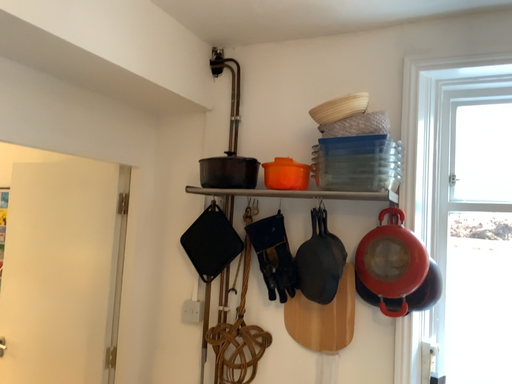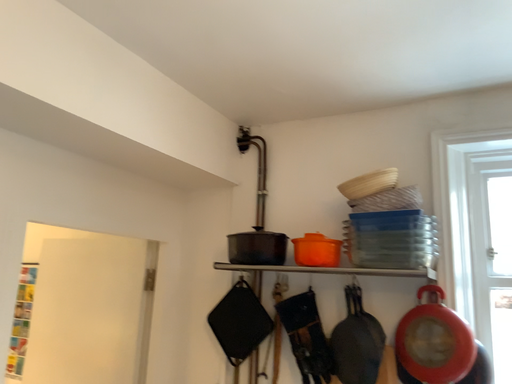
Question: How did the camera likely rotate when shooting the video?

Choices:
 (A) rotated downward
 (B) rotated upward

Answer: (B)